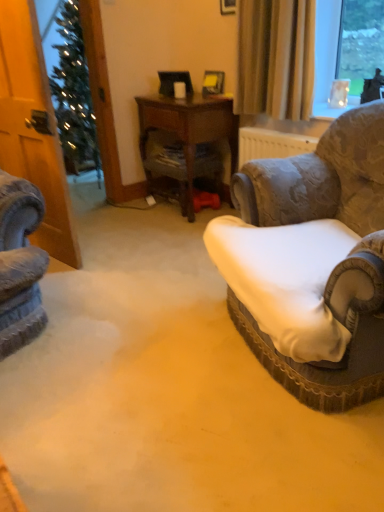
Question: Is white fabric cushion at right in front of wooden desk at center?

Choices:
 (A) yes
 (B) no

Answer: (A)

Question: Is white fabric cushion at right shorter than wooden desk at center?

Choices:
 (A) yes
 (B) no

Answer: (A)

Question: Could you tell me if white fabric cushion at right is turned towards wooden desk at center?

Choices:
 (A) yes
 (B) no

Answer: (B)

Question: Are white fabric cushion at right and wooden desk at center far apart?

Choices:
 (A) no
 (B) yes

Answer: (B)

Question: Does white fabric cushion at right appear on the right side of wooden desk at center?

Choices:
 (A) yes
 (B) no

Answer: (B)

Question: In terms of width, does beige fabric curtain at upper right look wider or thinner when compared to white fabric cushion at right?

Choices:
 (A) wide
 (B) thin

Answer: (B)

Question: From the image's perspective, is beige fabric curtain at upper right positioned above or below white fabric cushion at right?

Choices:
 (A) above
 (B) below

Answer: (A)

Question: Considering the positions of beige fabric curtain at upper right and white fabric cushion at right in the image, is beige fabric curtain at upper right taller or shorter than white fabric cushion at right?

Choices:
 (A) short
 (B) tall

Answer: (B)

Question: Which is correct: beige fabric curtain at upper right is inside white fabric cushion at right, or outside of it?

Choices:
 (A) outside
 (B) inside

Answer: (A)

Question: In terms of height, does velvet-patterned armchair at right look taller or shorter compared to wooden desk at center?

Choices:
 (A) tall
 (B) short

Answer: (A)

Question: Based on their positions, is velvet-patterned armchair at right located to the left or right of wooden desk at center?

Choices:
 (A) right
 (B) left

Answer: (A)

Question: Is velvet-patterned armchair at right bigger or smaller than wooden desk at center?

Choices:
 (A) big
 (B) small

Answer: (A)

Question: Do you think velvet-patterned armchair at right is within wooden desk at center, or outside of it?

Choices:
 (A) outside
 (B) inside

Answer: (A)

Question: Do you think beige fabric curtain at upper right is within velvet-patterned armchair at right, or outside of it?

Choices:
 (A) inside
 (B) outside

Answer: (B)

Question: In terms of size, does beige fabric curtain at upper right appear bigger or smaller than velvet-patterned armchair at right?

Choices:
 (A) big
 (B) small

Answer: (B)